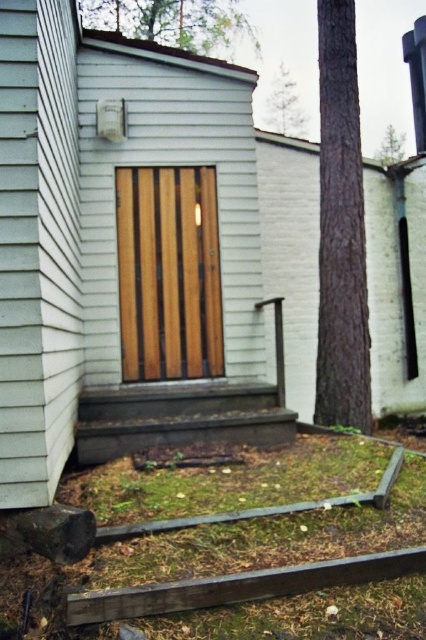
Between point (166, 340) and point (388, 145), which one is positioned behind?

The point (388, 145) is more distant.

How distant is wooden door at center from green leafy tree at upper right?

wooden door at center and green leafy tree at upper right are 11.89 meters apart from each other.

Which is in front, point (218, 234) or point (391, 152)?

Point (218, 234) is in front.

Image resolution: width=426 pixels, height=640 pixels. Identify the location of wooden door at center. (169, 273).

Does brown rough bark tree at right have a larger size compared to green textured tree at upper center?

Yes.

In order to click on brown rough bark tree at right in this screenshot , I will do `click(340, 228)`.

Locate an element on the screen. brown rough bark tree at right is located at coordinates (340, 228).

Identify the location of brown rough bark tree at right. The height and width of the screenshot is (640, 426). click(x=340, y=228).

Describe the element at coordinates (170, 22) in the screenshot. The image size is (426, 640). I see `green leafy tree at upper center` at that location.

Is point (221, 45) positioned in front of point (393, 160)?

Yes, it is in front of point (393, 160).

The image size is (426, 640). What do you see at coordinates (170, 22) in the screenshot? I see `green leafy tree at upper center` at bounding box center [170, 22].

Locate an element on the screen. green leafy tree at upper center is located at coordinates (170, 22).